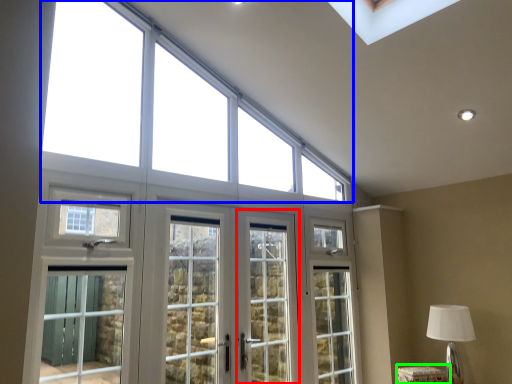
Question: Which object is positioned closest to screen door (highlighted by a red box)? Select from window (highlighted by a blue box) and furniture (highlighted by a green box).

Choices:
 (A) window
 (B) furniture

Answer: (A)